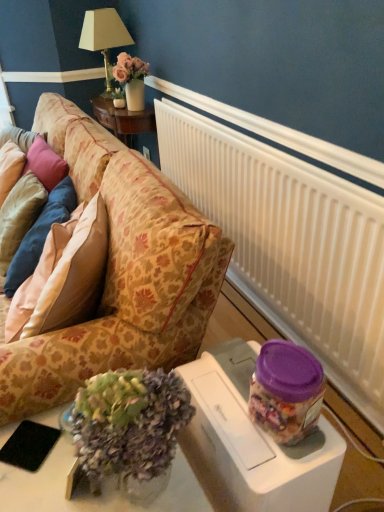
Where is `free point above transparent plastic container at lower right, marked as the 2th table in a left-to-right arrangement (from a real-world perspective)`? This screenshot has height=512, width=384. free point above transparent plastic container at lower right, marked as the 2th table in a left-to-right arrangement (from a real-world perspective) is located at coordinates (253, 401).